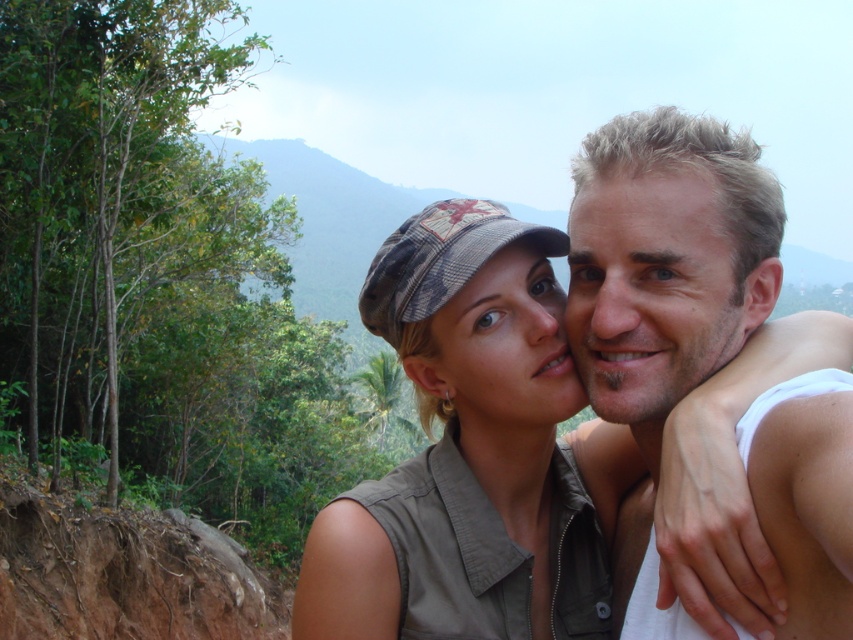
Question: From the image, what is the correct spatial relationship of blonde hair at right in relation to matte khaki cap at center?

Choices:
 (A) left
 (B) right

Answer: (B)

Question: Estimate the real-world distances between objects in this image. Which object is closer to the blonde hair at right?

Choices:
 (A) matte khaki cap at center
 (B) khaki fabric cap at center
 (C) smooth skin face at right

Answer: (C)

Question: Which is nearer to the matte khaki cap at center?

Choices:
 (A) khaki fabric cap at center
 (B) blonde hair at right
 (C) smooth skin face at right

Answer: (A)

Question: Among these points, which one is nearest to the camera?

Choices:
 (A) (828, 326)
 (B) (828, 579)

Answer: (B)

Question: From the image, what is the correct spatial relationship of khaki fabric cap at center in relation to blonde hair at right?

Choices:
 (A) right
 (B) left

Answer: (B)

Question: Observing the image, what is the correct spatial positioning of smooth skin face at right in reference to matte khaki cap at center?

Choices:
 (A) below
 (B) above

Answer: (B)